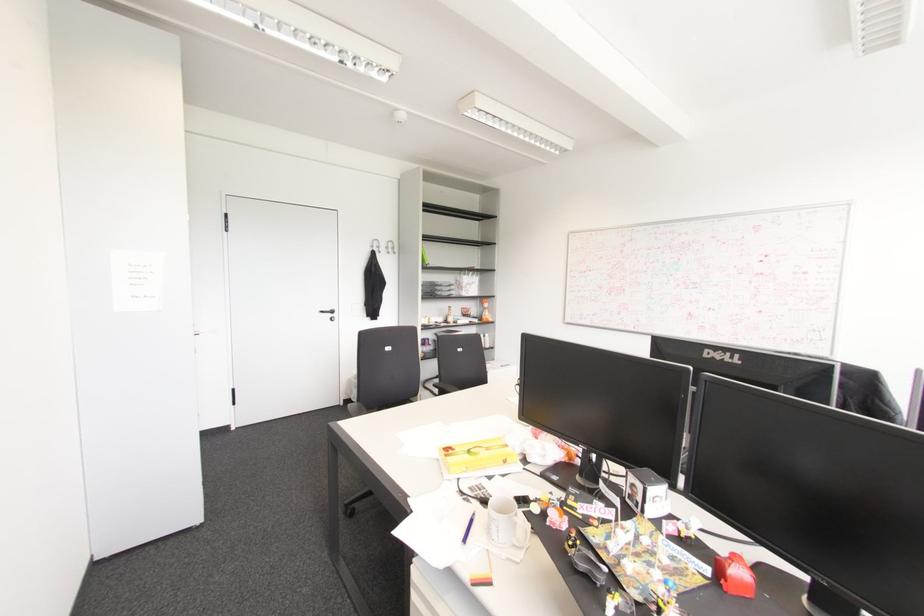
Describe the element at coordinates (521, 532) in the screenshot. I see `a white mug handle` at that location.